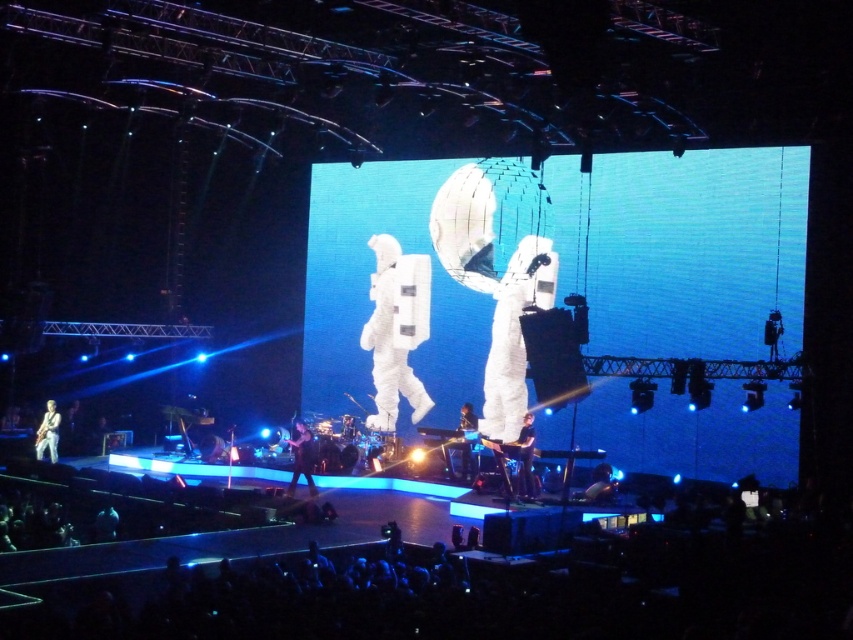
Can you confirm if white fabric astronaut at center is smaller than shiny black guitar at center?

No, white fabric astronaut at center is not smaller than shiny black guitar at center.

Between point (393, 385) and point (531, 420), which one is positioned in front?

Point (531, 420) is more forward.

Who is more forward, (375, 240) or (531, 444)?

Positioned in front is point (531, 444).

Identify the location of white fabric astronaut at center. The image size is (853, 640). (396, 330).

Does point (392, 317) come in front of point (39, 445)?

No, it is not.

Is white fabric astronaut at center positioned at the back of light brown leather guitar at lower left?

Yes, it is behind light brown leather guitar at lower left.

Between point (416, 307) and point (38, 460), which one is positioned behind?

Point (416, 307)

Find the location of a particular element. This screenshot has width=853, height=640. white fabric astronaut at center is located at coordinates (396, 330).

Is white fabric astronaut at center shorter than shiny metallic helmet at lower center?

No.

Does white fabric astronaut at center have a smaller size compared to shiny metallic helmet at lower center?

No.

Who is more forward, (389, 356) or (589, 492)?

Positioned in front is point (589, 492).

Where is `white fabric astronaut at center`? This screenshot has width=853, height=640. white fabric astronaut at center is located at coordinates (396, 330).